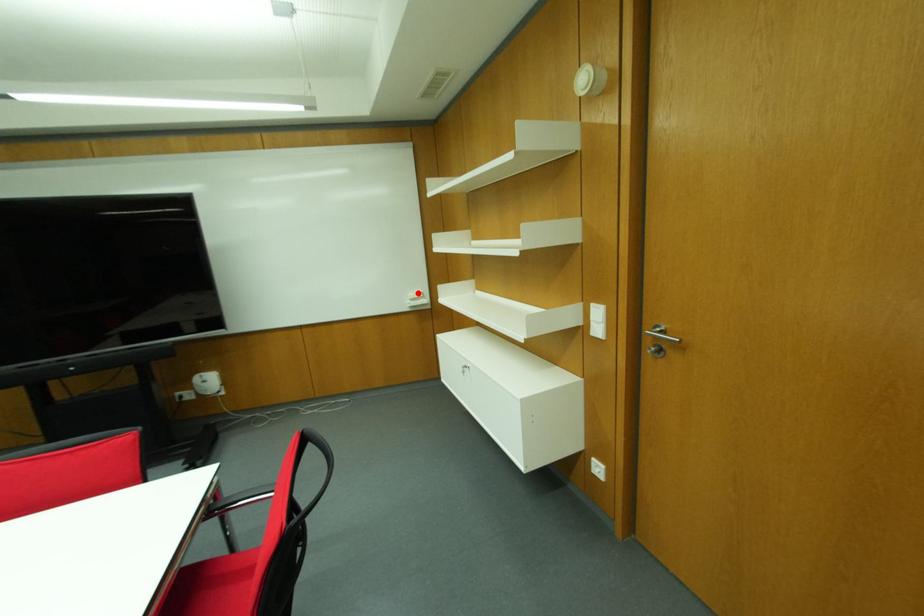
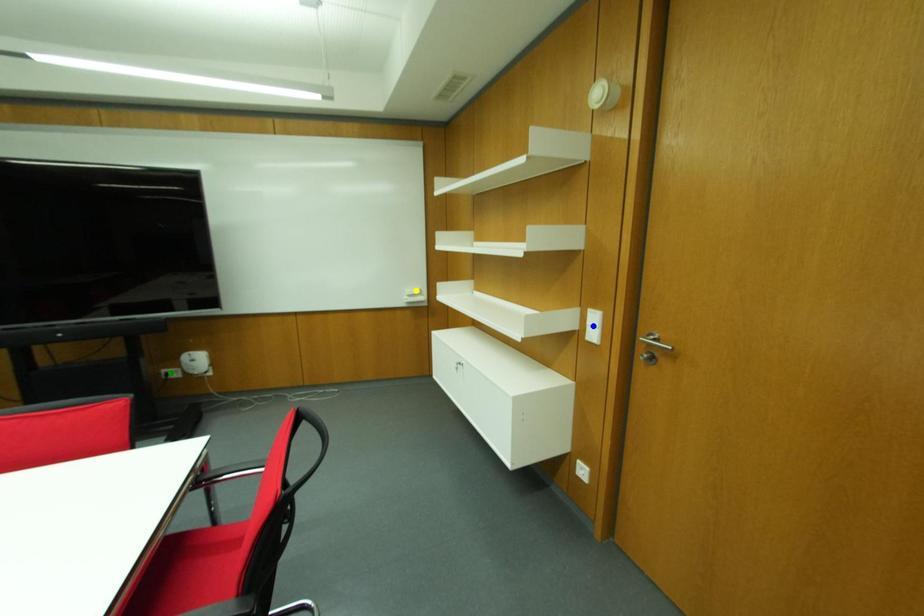
Question: I am providing you with two images of the same scene from different viewpoints. A red point is marked on the first image. You are given multiple points on the second image. Can you choose the point in image 2 that corresponds to the point in image 1?

Choices:
 (A) blue point
 (B) yellow point
 (C) green point

Answer: (B)